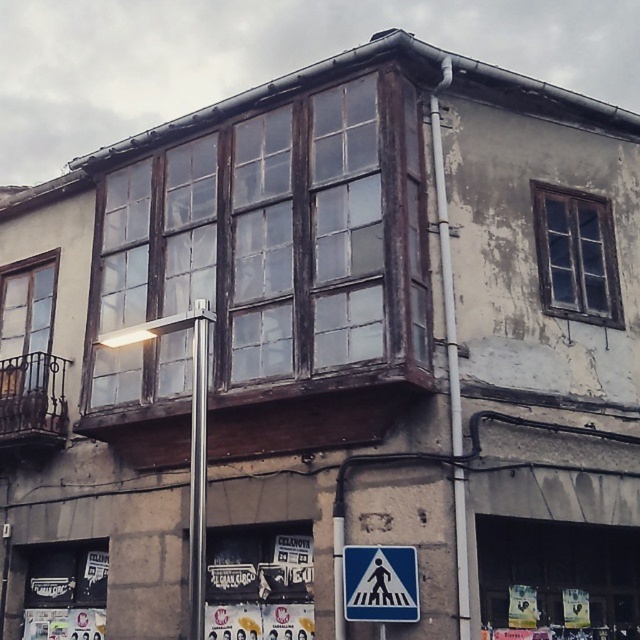
Question: Is wooden balcony at left bigger than silver metallic pole at center?

Choices:
 (A) no
 (B) yes

Answer: (B)

Question: Which of these objects is positioned farthest from the wooden bay window at center?

Choices:
 (A) dark brown wooden window at upper right
 (B) silver metallic pole at center

Answer: (A)

Question: Which object is the closest to the wooden balcony at left?

Choices:
 (A) blue plastic pedestrian crossing sign at lower center
 (B) wooden bay window at center

Answer: (B)

Question: Does wooden balcony at left appear on the right side of blue plastic pedestrian crossing sign at lower center?

Choices:
 (A) no
 (B) yes

Answer: (A)

Question: Among these objects, which one is nearest to the camera?

Choices:
 (A) blue plastic pedestrian crossing sign at lower center
 (B) wooden balcony at left

Answer: (A)

Question: Is wooden balcony at left thinner than silver metallic pole at center?

Choices:
 (A) no
 (B) yes

Answer: (A)